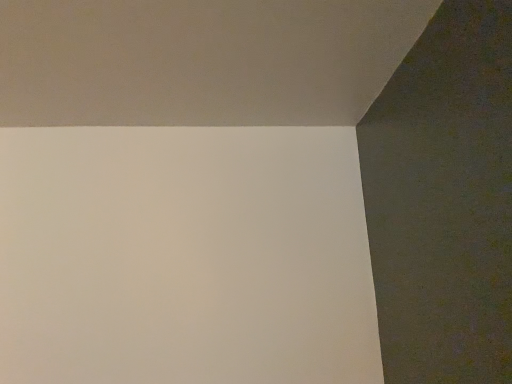
This screenshot has height=384, width=512. I want to click on white matte wall at upper right, so click(x=200, y=60).

Image resolution: width=512 pixels, height=384 pixels. What do you see at coordinates (200, 60) in the screenshot?
I see `white matte wall at upper right` at bounding box center [200, 60].

What are the coordinates of `white matte wall at upper right` in the screenshot? It's located at (200, 60).